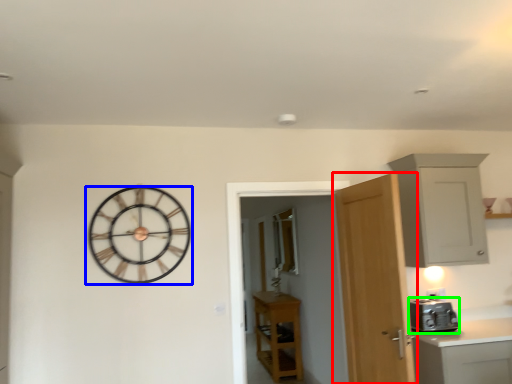
Question: Estimate the real-world distances between objects in this image. Which object is closer to door (highlighted by a red box), wall clock (highlighted by a blue box) or appliance (highlighted by a green box)?

Choices:
 (A) wall clock
 (B) appliance

Answer: (B)